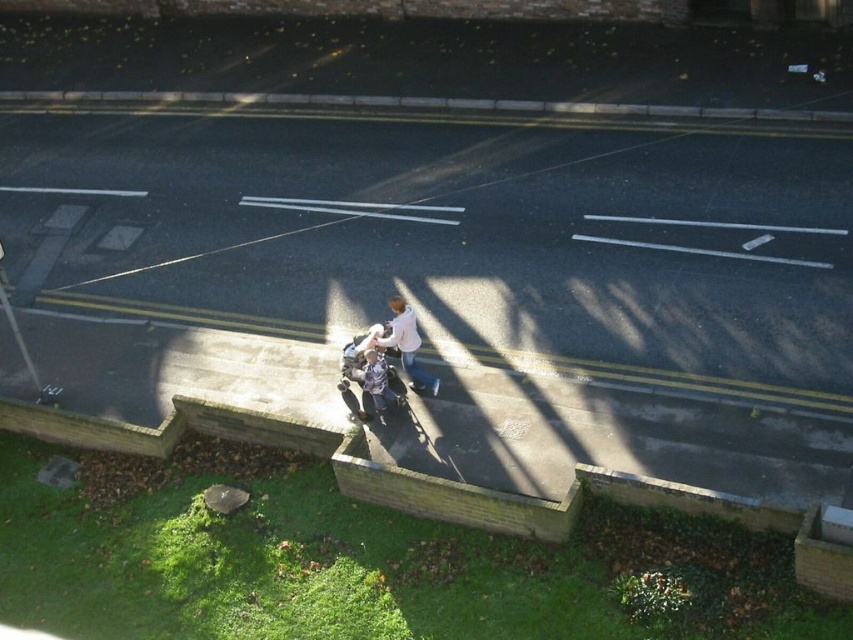
You are a fashion designer observing the scene from the elevated perspective. You notice the white matte shirt at center and the blue denim jacket at center. Which clothing item appears bigger in size?

The white matte shirt at center has a larger size compared to the blue denim jacket at center, so the white matte shirt at center appears bigger.

You are a delivery person trying to deliver a package to the blue denim jacket at center. You are currently standing at the white matte shirt at center. Can you directly hand over the package without needing to go around any obstacles?

The white matte shirt at center is in front of blue denim jacket at center, so you cannot directly hand over the package without moving around the white matte shirt at center.

You are a photographer trying to capture a candid shot of the two people near the stroller. Since you want to focus on the person in the white matte shirt at center, which direction should you aim your camera relative to the blue denim jacket at center?

The white matte shirt at center is positioned on the right side of the blue denim jacket at center, so you should aim your camera to the right of the blue denim jacket at center to focus on the person in the white matte shirt at center.